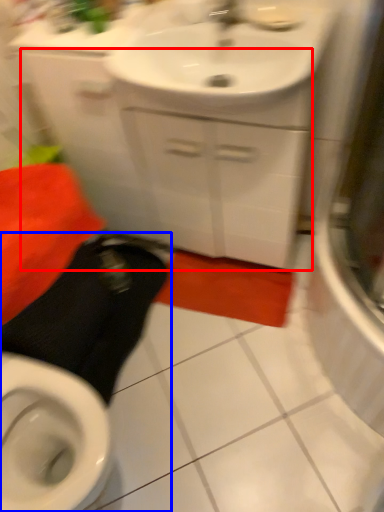
Question: Which of the following is the farthest to the observer, cabinetry (highlighted by a red box) or squat (highlighted by a blue box)?

Choices:
 (A) cabinetry
 (B) squat

Answer: (A)